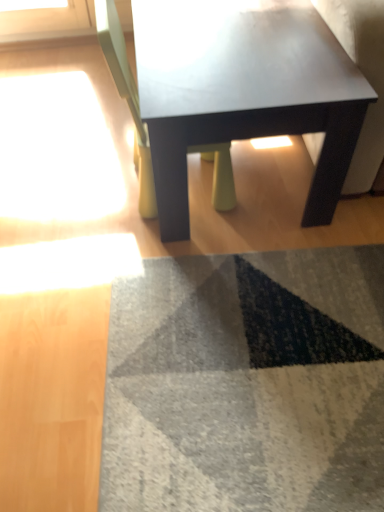
Question: Is matte black coffee table at center taller than matte white chair at center?

Choices:
 (A) yes
 (B) no

Answer: (B)

Question: From the image's perspective, is matte black coffee table at center over matte white chair at center?

Choices:
 (A) no
 (B) yes

Answer: (B)

Question: From a real-world perspective, is matte black coffee table at center on top of matte white chair at center?

Choices:
 (A) yes
 (B) no

Answer: (B)

Question: Would you say matte black coffee table at center contains matte white chair at center?

Choices:
 (A) yes
 (B) no

Answer: (A)

Question: Is matte black coffee table at center bigger than matte white chair at center?

Choices:
 (A) yes
 (B) no

Answer: (A)

Question: Is matte black coffee table at center facing towards matte white chair at center?

Choices:
 (A) no
 (B) yes

Answer: (B)

Question: Does matte white chair at center have a smaller size compared to matte black coffee table at center?

Choices:
 (A) no
 (B) yes

Answer: (B)

Question: Considering the relative positions of matte white chair at center and matte black coffee table at center in the image provided, is matte white chair at center in front of matte black coffee table at center?

Choices:
 (A) yes
 (B) no

Answer: (A)

Question: Does matte white chair at center contain matte black coffee table at center?

Choices:
 (A) yes
 (B) no

Answer: (B)

Question: Could you tell me if matte white chair at center is facing matte black coffee table at center?

Choices:
 (A) yes
 (B) no

Answer: (A)

Question: Is the position of matte white chair at center more distant than that of matte black coffee table at center?

Choices:
 (A) no
 (B) yes

Answer: (A)

Question: From the image's perspective, is matte white chair at center above matte black coffee table at center?

Choices:
 (A) yes
 (B) no

Answer: (B)

Question: Relative to matte black coffee table at center, is matte white chair at center in front or behind?

Choices:
 (A) behind
 (B) front

Answer: (B)